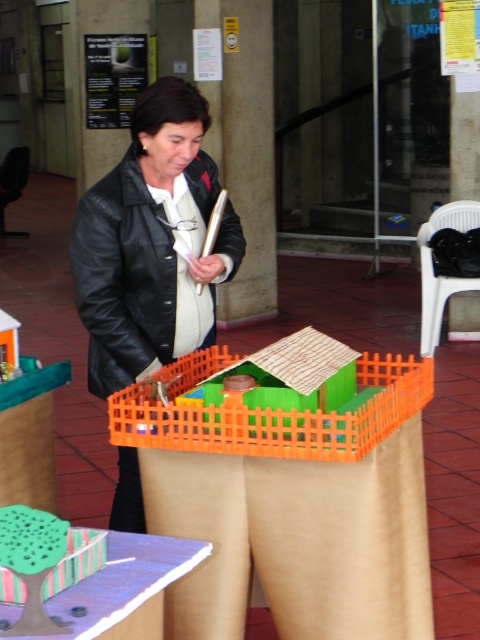
You are a fashion designer analyzing the placement of items in the scene. Where is the black leather jacket at center located in terms of coordinates?

The black leather jacket at center is located at coordinates point [152,243].

Consider the image. You are a delivery person who needs to place a large package on the table where the black leather jacket at center and the green plastic house at center are located. Which object should you move to make space?

The black leather jacket at center is larger in size than the green plastic house at center, so you should move the black leather jacket at center to make space for the large package.